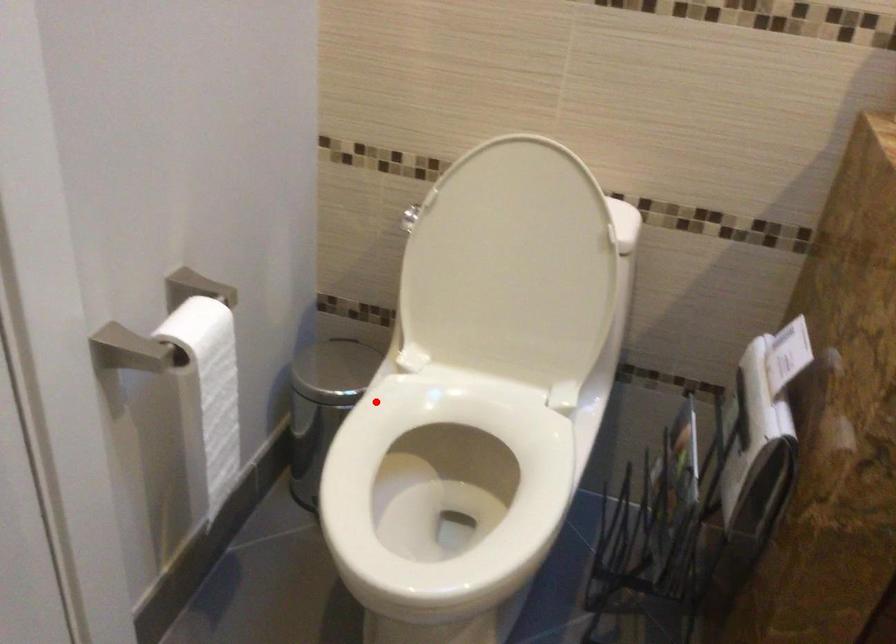
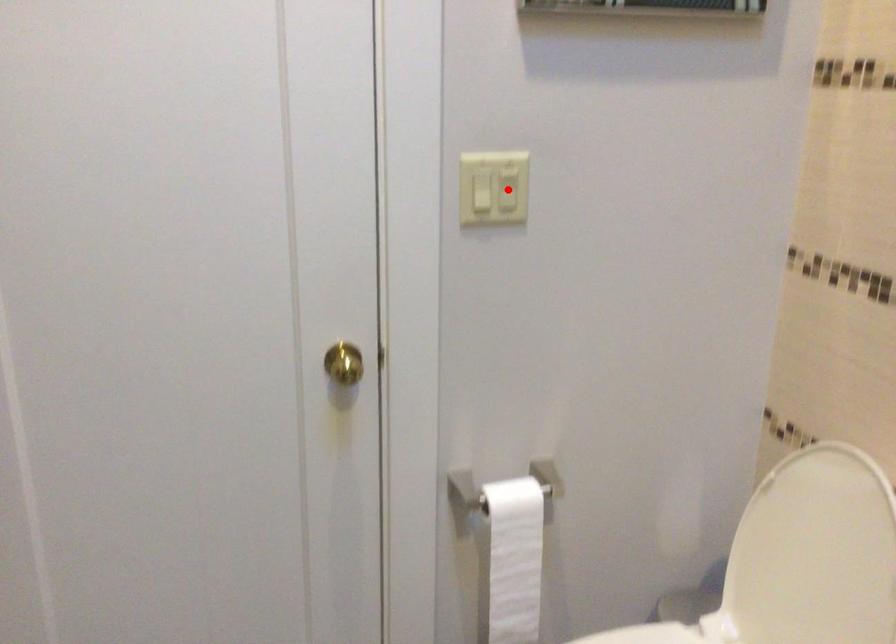
I am providing you with two images of the same scene from different viewpoints. A red point is marked on the first image and another point is marked on the second image. Are the points marked in image1 and image2 representing the same 3D position?

No